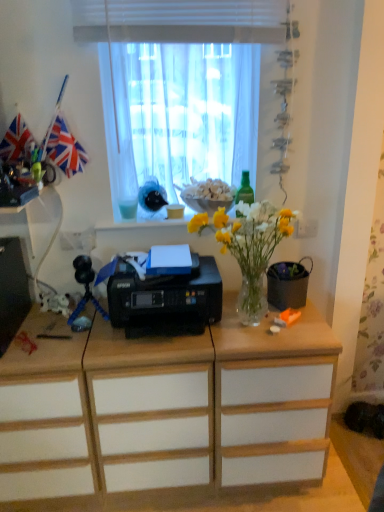
Locate an element on the screen. free space above white wood drawer at center, the second drawer from the right (from a real-world perspective) is located at coordinates (39, 328).